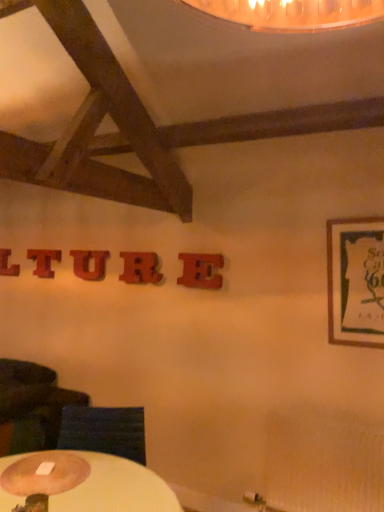
Locate an element on the screen. This screenshot has width=384, height=512. wooden coaster at lower left is located at coordinates (104, 431).

This screenshot has height=512, width=384. What do you see at coordinates (44, 261) in the screenshot?
I see `wooden letter at upper left, the 2th letter viewed from the back` at bounding box center [44, 261].

Measure the distance between point (152, 280) and camera.

Point (152, 280) is 9.99 feet from camera.

Find the location of a particular element. This screenshot has width=384, height=512. wooden letter at center, marked as the fourth letter in a back-to-front arrangement is located at coordinates (140, 268).

The height and width of the screenshot is (512, 384). What do you see at coordinates (7, 264) in the screenshot?
I see `red wood letter at center, the 5th letter from the front` at bounding box center [7, 264].

This screenshot has width=384, height=512. Find the location of `red wood letter at center, arranged as the 1th letter when viewed from the left`. red wood letter at center, arranged as the 1th letter when viewed from the left is located at coordinates (7, 264).

What is the approximate height of wooden round table lamp at lower left?

wooden round table lamp at lower left is 1.95 inches tall.

In order to face wooden letter u at center, the third letter from the left, should I rotate leftwards or rightwards?

It's best to rotate left around 13.866 degrees.

Where is `wooden coaster at lower left`? wooden coaster at lower left is located at coordinates (104, 431).

Is wooden framed poster at right located within wooden letter at upper left, the fourth letter from the front?

Actually, wooden framed poster at right is outside wooden letter at upper left, the fourth letter from the front.

Does wooden letter at upper left, marked as the 4th letter in a right-to-left arrangement, have a greater height compared to wooden framed poster at right?

Answer: No.

Which is closer to the camera, [43,268] or [354,273]?

The point [354,273] is in front.

Is wooden letter at upper left, the 2th letter viewed from the left, oriented towards wooden framed poster at right?

No, wooden letter at upper left, the 2th letter viewed from the left, is not aimed at wooden framed poster at right.

Looking at this image, in the image, is wooden coaster at lower left positioned in front of or behind wooden letter at upper left, the 2th letter viewed from the left?

Clearly, wooden coaster at lower left is in front of wooden letter at upper left, the 2th letter viewed from the left.

Find the location of `furniture in front of the wooden letter at upper left, the 2th letter viewed from the left`. furniture in front of the wooden letter at upper left, the 2th letter viewed from the left is located at coordinates tap(104, 431).

Which point is more distant from viewer, (93, 439) or (28, 257)?

The point (28, 257) is farther.

Is point (76, 469) in front of point (5, 264)?

Yes, point (76, 469) is in front of point (5, 264).

Is wooden round table lamp at lower left not close to red wood letter at center, arranged as the 1th letter when viewed from the left?

wooden round table lamp at lower left is far away from red wood letter at center, arranged as the 1th letter when viewed from the left.

Which of these two, wooden round table lamp at lower left or red wood letter at center, the 5th letter from the front, stands taller?

Standing taller between the two is red wood letter at center, the 5th letter from the front.

Measure the distance from wooden round table lamp at lower left to red wood letter at center, which appears as the first letter when viewed from the back.

The distance of wooden round table lamp at lower left from red wood letter at center, which appears as the first letter when viewed from the back, is 7.56 feet.

Is matte wood letter e at center, the 5th letter from the back, inside red wood letter at center, arranged as the 1th letter when viewed from the left?

No.

From the image's perspective, which object appears higher, red wood letter at center, the 5th letter from the front, or matte wood letter e at center, the 5th letter from the back?

From the image's view, red wood letter at center, the 5th letter from the front, is above.

Is red wood letter at center, which appears as the first letter when viewed from the back, next to matte wood letter e at center, the 5th letter from the back, and touching it?

red wood letter at center, which appears as the first letter when viewed from the back, and matte wood letter e at center, the 5th letter from the back, are clearly separated.

Which of these two, red wood letter at center, the fifth letter viewed from the right, or matte wood letter e at center, which is the 5th letter in left-to-right order, is smaller?

Smaller between the two is red wood letter at center, the fifth letter viewed from the right.

Can you confirm if wooden framed poster at right is shorter than red wood letter at center, arranged as the 1th letter when viewed from the left?

Incorrect, the height of wooden framed poster at right does not fall short of that of red wood letter at center, arranged as the 1th letter when viewed from the left.

Is wooden framed poster at right located outside red wood letter at center, arranged as the 1th letter when viewed from the left?

Yes, wooden framed poster at right is outside of red wood letter at center, arranged as the 1th letter when viewed from the left.

Are wooden framed poster at right and red wood letter at center, the fifth letter viewed from the right, beside each other?

wooden framed poster at right and red wood letter at center, the fifth letter viewed from the right, are not in contact.

From a real-world perspective, who is located lower, wooden letter u at center, the 3th letter viewed from the back, or matte wood letter e at center, the first letter viewed from the right?

matte wood letter e at center, the first letter viewed from the right.

Relative to matte wood letter e at center, the first letter viewed from the right, is wooden letter u at center, the 3th letter viewed from the back, in front or behind?

Visually, wooden letter u at center, the 3th letter viewed from the back, is located behind matte wood letter e at center, the first letter viewed from the right.

Based on the photo, which of these two, wooden letter u at center, the third letter from the left, or matte wood letter e at center, the first letter viewed from the right, is thinner?

wooden letter u at center, the third letter from the left.

From the image's perspective, relative to matte wood letter e at center, the first letter viewed from the right, is wooden letter u at center, the 3th letter viewed from the back, above or below?

From the image's perspective, wooden letter u at center, the 3th letter viewed from the back, appears above matte wood letter e at center, the first letter viewed from the right.

Between wooden letter at center, which is the 2th letter from right to left, and wooden framed poster at right, which one has smaller size?

With smaller size is wooden letter at center, which is the 2th letter from right to left.

Which is correct: wooden letter at center, which is the 2th letter from right to left, is inside wooden framed poster at right, or outside of it?

wooden letter at center, which is the 2th letter from right to left, exists outside the volume of wooden framed poster at right.

Between wooden letter at center, placed as the fourth letter when sorted from left to right, and wooden framed poster at right, which one appears on the left side from the viewer's perspective?

From the viewer's perspective, wooden letter at center, placed as the fourth letter when sorted from left to right, appears more on the left side.

The image size is (384, 512). In order to click on the 4th letter to the left of the wooden framed poster at right, starting your count from the anchor in this screenshot , I will do `click(44, 261)`.

At what (x,y) coordinates should I click in order to perform the action: click on furniture lying on the right of wooden letter at upper left, marked as the 4th letter in a right-to-left arrangement. Please return your answer as a coordinate pair (x, y). This screenshot has width=384, height=512. Looking at the image, I should click on (104, 431).

Considering their positions, is wooden letter at center, placed as the fourth letter when sorted from left to right, positioned further to red wood letter at center, the 5th letter from the front, than wooden letter at upper left, the fourth letter from the front?

Based on the image, wooden letter at center, placed as the fourth letter when sorted from left to right, appears to be further to red wood letter at center, the 5th letter from the front.

Consider the image. When comparing their distances from wooden coaster at lower left, does wooden framed poster at right or wooden letter at center, marked as the fourth letter in a back-to-front arrangement, seem further?

The object further to wooden coaster at lower left is wooden framed poster at right.

Based on the photo, estimate the real-world distances between objects in this image. Which object is further from wooden framed poster at right, wooden coaster at lower left or wooden letter at center, marked as the fourth letter in a back-to-front arrangement?

wooden coaster at lower left is further to wooden framed poster at right.

Based on their spatial positions, is wooden letter u at center, the 3th letter viewed from the back, or wooden letter at upper left, the 2th letter viewed from the back, further from red wood letter at center, which appears as the first letter when viewed from the back?

wooden letter u at center, the 3th letter viewed from the back, is positioned further to the anchor red wood letter at center, which appears as the first letter when viewed from the back.

When comparing their distances from wooden letter at center, which is the second letter in front-to-back order, does wooden round table lamp at lower left or wooden coaster at lower left seem further?

Among the two, wooden round table lamp at lower left is located further to wooden letter at center, which is the second letter in front-to-back order.

Based on their spatial positions, is red wood letter at center, the 5th letter from the front, or matte wood letter e at center, the first letter in the front-to-back sequence, further from wooden round table lamp at lower left?

red wood letter at center, the 5th letter from the front, is positioned further to the anchor wooden round table lamp at lower left.

Based on the photo, from the image, which object appears to be farther from wooden letter at center, which is the 2th letter from right to left, wooden framed poster at right or wooden round table lamp at lower left?

wooden round table lamp at lower left.

Looking at the image, which one is located closer to wooden round table lamp at lower left, wooden coaster at lower left or wooden letter at upper left, marked as the 4th letter in a right-to-left arrangement?

Among the two, wooden coaster at lower left is located nearer to wooden round table lamp at lower left.

You are a GUI agent. You are given a task and a screenshot of the screen. Output one action in this format:
    pyautogui.click(x=<x>, y=<y>)
    Task: Click on the furniture located between wooden letter u at center, acting as the third letter starting from the front, and wooden framed poster at right in the left-right direction
    This screenshot has height=512, width=384.
    Given the screenshot: What is the action you would take?
    pyautogui.click(x=104, y=431)

Identify the location of table lamp located between red wood letter at center, the fifth letter viewed from the right, and wooden framed poster at right in the left-right direction. (44, 474).

Locate an element on the screen. The image size is (384, 512). table lamp between wooden letter at upper left, the fourth letter from the front, and wooden framed poster at right, in the horizontal direction is located at coordinates (44, 474).

Locate an element on the screen. This screenshot has width=384, height=512. furniture located between red wood letter at center, the fifth letter viewed from the right, and matte wood letter e at center, the first letter in the front-to-back sequence, in the left-right direction is located at coordinates (104, 431).